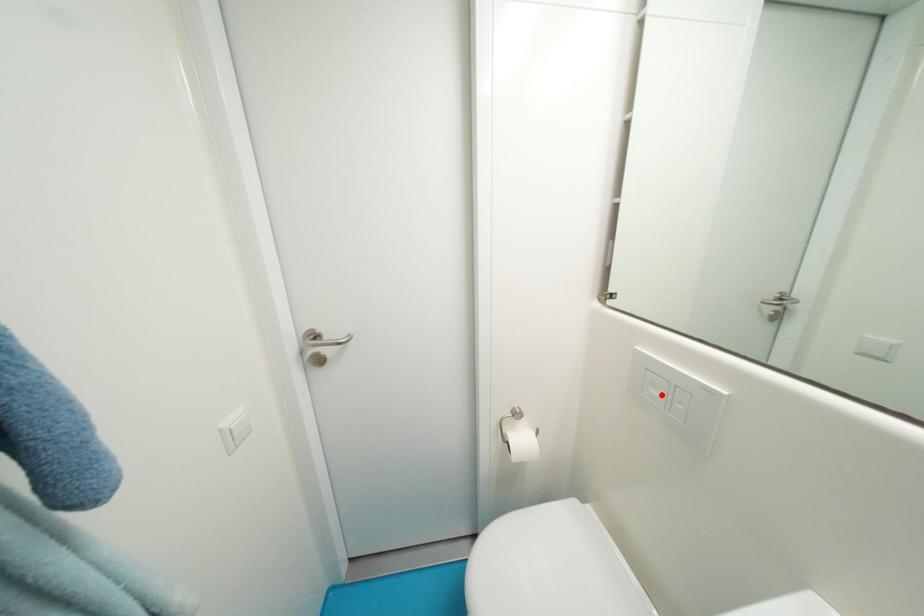
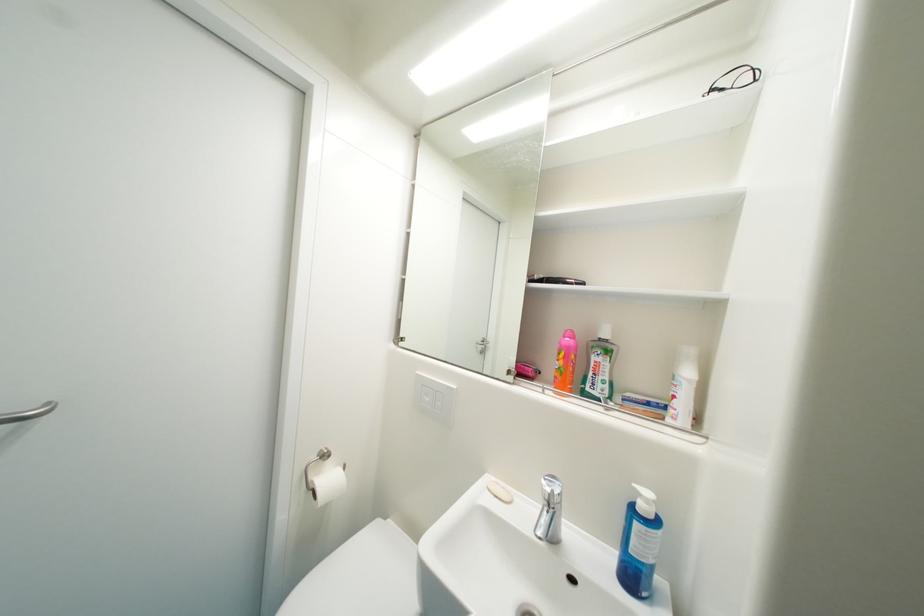
Where in the second image is the point corresponding to the highlighted location from the first image?

(433, 400)